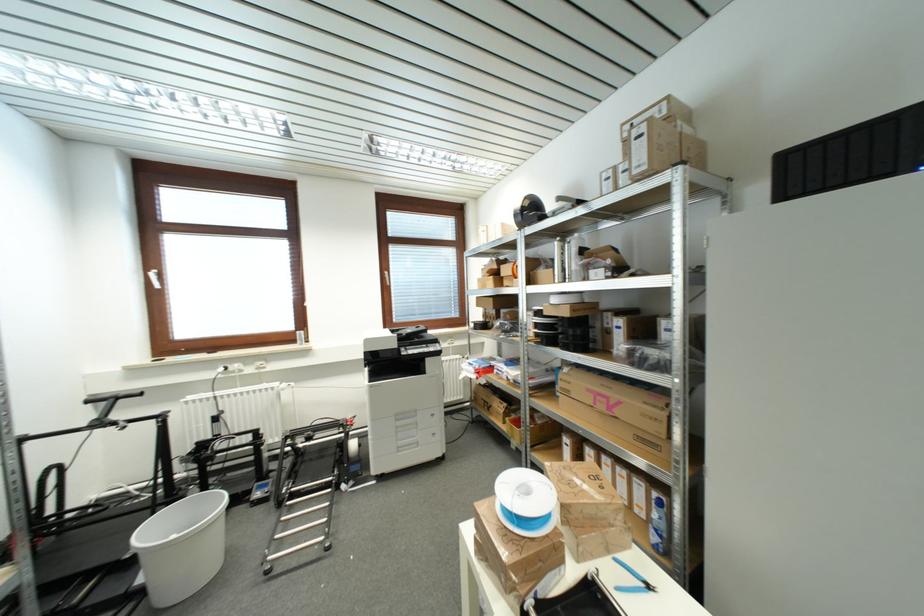
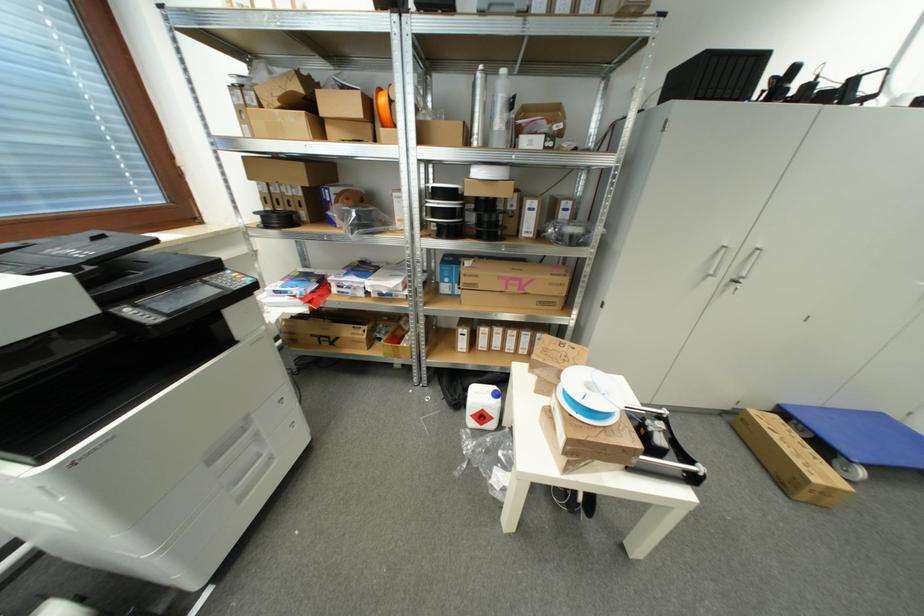
Find the pixel in the second image that matches point 605,408 in the first image.

(517, 292)